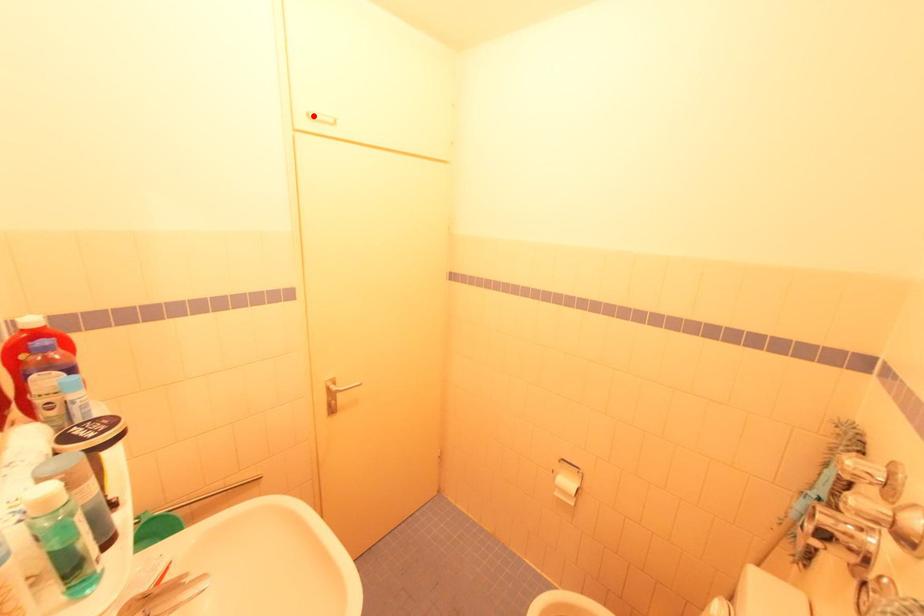
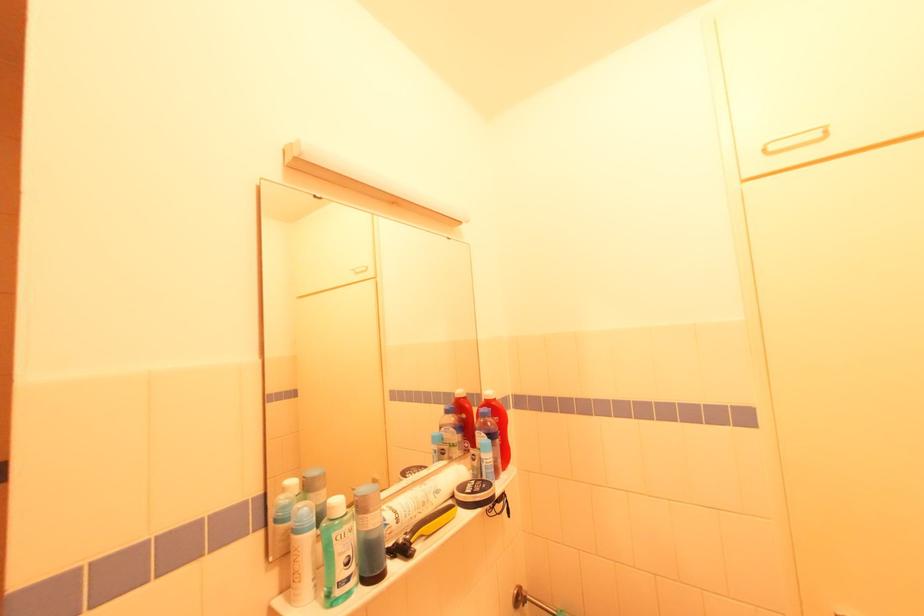
Question: I am providing you with two images of the same scene from different viewpoints. A red point is marked on the first image. Can you still see the location of the red point in image 2?

Choices:
 (A) Yes
 (B) No

Answer: (A)